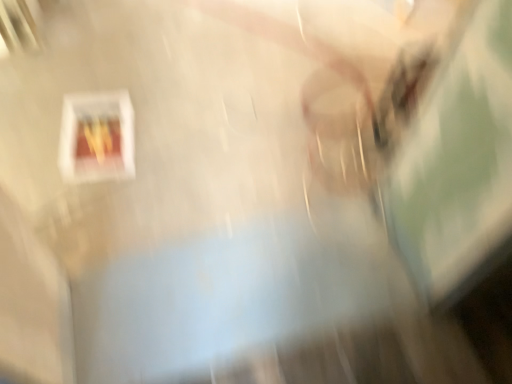
Locate an element on the screen. The width and height of the screenshot is (512, 384). vacant space in front of matte wooden picture frame at lower left is located at coordinates (88, 202).